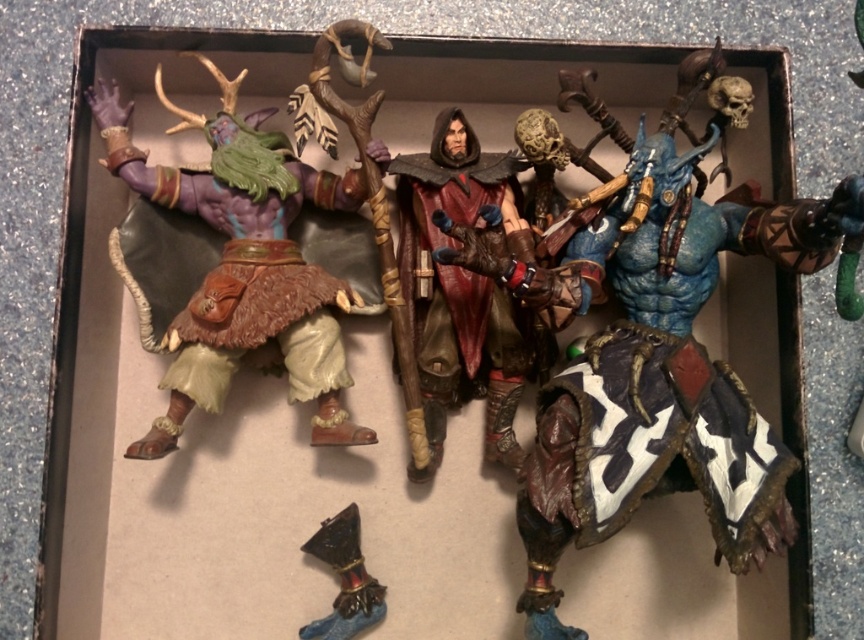
Question: Which of the following is the closest to the observer?

Choices:
 (A) (262, 292)
 (B) (467, 372)
 (C) (324, 545)

Answer: (A)

Question: Which point appears farthest from the camera in this image?

Choices:
 (A) (397, 196)
 (B) (338, 525)

Answer: (A)

Question: Is smooth brown cape at center thinner than metallic blue boot at lower center?

Choices:
 (A) no
 (B) yes

Answer: (A)

Question: Is matte purple skin at left further to camera compared to metallic blue boot at lower center?

Choices:
 (A) no
 (B) yes

Answer: (A)

Question: Can you confirm if smooth brown cape at center is smaller than metallic blue boot at lower center?

Choices:
 (A) no
 (B) yes

Answer: (A)

Question: Which point appears closest to the camera in this image?

Choices:
 (A) (439, 416)
 (B) (322, 529)
 (C) (353, 301)

Answer: (C)